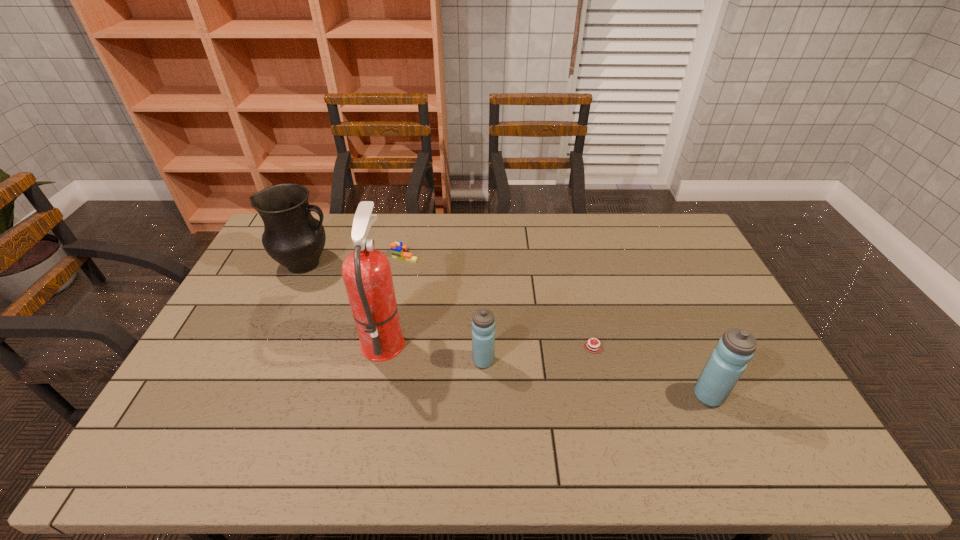
This screenshot has height=540, width=960. I want to click on vacant space that satisfies the following two spatial constraints: 1. on the handle side of the leftmost object; 2. on the right side of the rightmost object, so click(246, 396).